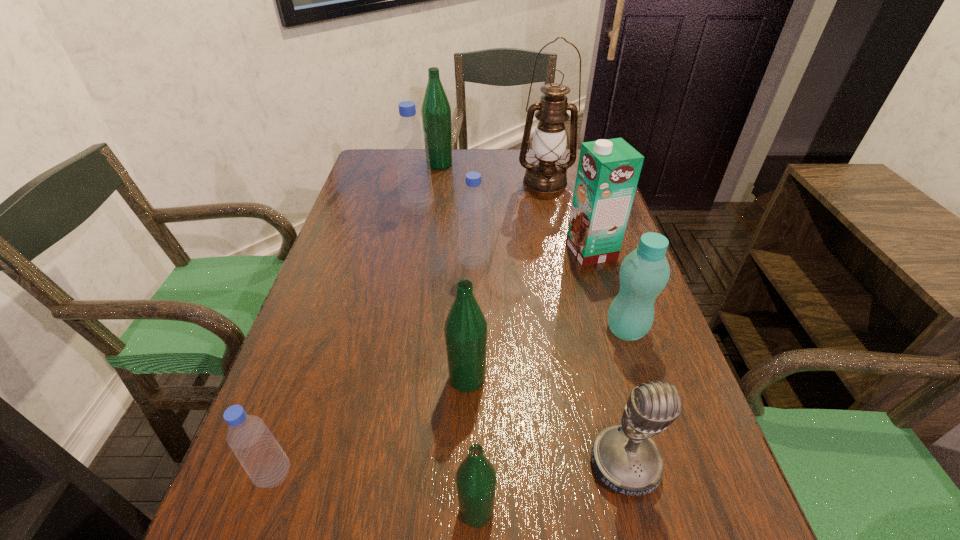
The image size is (960, 540). I want to click on bottle present at the right edge, so click(644, 272).

The width and height of the screenshot is (960, 540). Find the location of `microphone situated at the right edge`. microphone situated at the right edge is located at coordinates (626, 460).

Locate an element on the screen. The width and height of the screenshot is (960, 540). object situated at the far right corner is located at coordinates [545, 175].

In the image, there is a desktop. Where is `vacant space at the left edge`? The image size is (960, 540). vacant space at the left edge is located at coordinates (400, 203).

Identify the location of free space at the right edge. The height and width of the screenshot is (540, 960). (570, 251).

In the image, there is a desktop. Where is `vacant space at the far left corner`? vacant space at the far left corner is located at coordinates click(x=386, y=159).

At what (x,y) coordinates should I click in order to perform the action: click on free spot between the smallest blue bottle and the carton. Please return your answer as a coordinate pair (x, y). Image resolution: width=960 pixels, height=540 pixels. Looking at the image, I should click on (433, 363).

Where is `free space between the fourth nearest bottle and the eighth nearest object`? The image size is (960, 540). free space between the fourth nearest bottle and the eighth nearest object is located at coordinates (522, 269).

Find the location of a particular element. free space between the third farthest object and the microphone is located at coordinates (521, 336).

Find the location of a particular element. The image size is (960, 540). blank region between the nearest green bottle and the fourth farthest bottle is located at coordinates (551, 420).